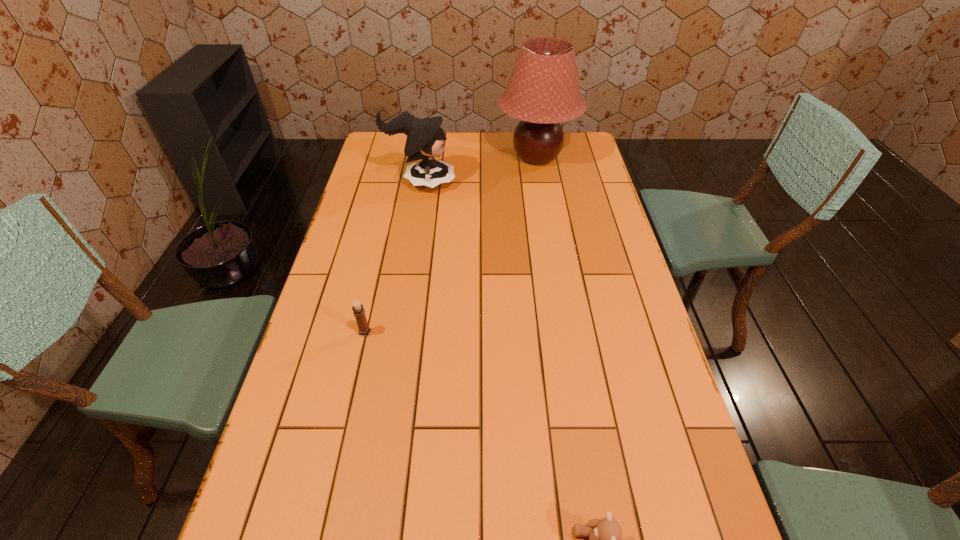
Locate an element on the screen. This screenshot has height=540, width=960. doll located in the left edge section of the desktop is located at coordinates (425, 137).

Where is `candle holder positioned at the left edge`? candle holder positioned at the left edge is located at coordinates (359, 312).

Identify the location of object that is at the right edge. (543, 90).

This screenshot has width=960, height=540. Identify the location of object situated at the far right corner. (543, 90).

The height and width of the screenshot is (540, 960). What are the coordinates of `free region at the far edge of the desktop` in the screenshot? It's located at (454, 144).

I want to click on free region at the left edge of the desktop, so click(327, 277).

What are the coordinates of `vacant region at the right edge of the desktop` in the screenshot? It's located at (603, 262).

In the image, there is a desktop. Where is `blank space at the far left corner`? This screenshot has height=540, width=960. blank space at the far left corner is located at coordinates (377, 147).

Find the location of `free area in between the second tallest object and the lampshade`. free area in between the second tallest object and the lampshade is located at coordinates (479, 170).

At what (x,y) coordinates should I click in order to perform the action: click on vacant region between the tallest object and the candle holder. Please return your answer as a coordinate pair (x, y). This screenshot has height=540, width=960. Looking at the image, I should click on (451, 245).